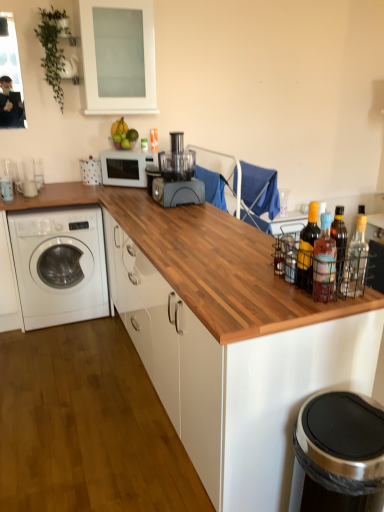
At what (x,y) coordinates should I click in order to perform the action: click on matte yellow glass bottle at right, which is the 3th bottle from right to left. Please return your answer as a coordinate pair (x, y). Image resolution: width=384 pixels, height=512 pixels. Looking at the image, I should click on (307, 249).

You are a GUI agent. You are given a task and a screenshot of the screen. Output one action in this format:
    pyautogui.click(x=<x>, y=<y>)
    Task: Click on the translucent glass bottles at right, the 2th bottle from the right
    
    Given the screenshot: What is the action you would take?
    pyautogui.click(x=324, y=263)

Identify the location of white glossy washing machine at left. (59, 265).

This screenshot has height=512, width=384. Find the location of `matte gray blender at center`. matte gray blender at center is located at coordinates (177, 176).

The image size is (384, 512). What do you see at coordinates (230, 339) in the screenshot?
I see `wooden at center` at bounding box center [230, 339].

In order to face wooden at center, should I rotate leftwards or rightwards?

Rotate left and turn 9.503 degrees.

The image size is (384, 512). Find the location of `clear glass bottle at right, the third bottle in the left-to-right sequence`. clear glass bottle at right, the third bottle in the left-to-right sequence is located at coordinates click(356, 259).

Identify the location of matte yellow glass bottle at right, which is the 3th bottle from right to left. The width and height of the screenshot is (384, 512). (307, 249).

From the matte gray blender at center, count 3rd bottle to the right and point to it. Please provide its 2D coordinates.

[(356, 259)]

Is clear glass bottle at right, placed as the 1th bottle when sorted from right to left, taller or shorter than matte gray blender at center?

Clearly, clear glass bottle at right, placed as the 1th bottle when sorted from right to left, is taller compared to matte gray blender at center.

From a real-world perspective, is clear glass bottle at right, acting as the 3th bottle starting from the front, under matte gray blender at center?

Yes, from a real-world perspective, clear glass bottle at right, acting as the 3th bottle starting from the front, is beneath matte gray blender at center.

Which point is more distant from viewer, (357, 289) or (189, 158)?

The point (189, 158) is farther from the camera.

Relative to clear glass bottle at right, which is counted as the first bottle, starting from the back, is matte gray blender at center in front or behind?

matte gray blender at center is in front of clear glass bottle at right, which is counted as the first bottle, starting from the back.

Which of these two, matte gray blender at center or clear glass bottle at right, acting as the 3th bottle starting from the front, is bigger?

Result: With larger size is clear glass bottle at right, acting as the 3th bottle starting from the front.

Which is behind, point (172, 173) or point (355, 238)?

The point (172, 173) is more distant.

Is matte gray blender at center positioned beyond the bounds of clear glass bottle at right, which is counted as the first bottle, starting from the back?

Yes, matte gray blender at center is outside of clear glass bottle at right, which is counted as the first bottle, starting from the back.

Considering the positions of objects white glossy washing machine at left and white matte microwave at center in the image provided, who is more to the left, white glossy washing machine at left or white matte microwave at center?

From the viewer's perspective, white glossy washing machine at left appears more on the left side.

The height and width of the screenshot is (512, 384). What are the coordinates of `home appliance that appears above the white glossy washing machine at left (from a real-world perspective)` in the screenshot? It's located at (126, 167).

In the scene shown: Is white glossy washing machine at left positioned beyond the bounds of white matte microwave at center?

Yes.

Is white matte microwave at center wider or thinner than matte gray blender at center?

In the image, white matte microwave at center appears to be more narrow than matte gray blender at center.

Is white matte microwave at center bigger than matte gray blender at center?

No, white matte microwave at center is not bigger than matte gray blender at center.

Can you tell me how much white matte microwave at center and matte gray blender at center differ in facing direction?

There is a 47.8-degree angle between the facing directions of white matte microwave at center and matte gray blender at center.

Can we say white matte microwave at center lies outside matte gray blender at center?

Yes, white matte microwave at center is outside of matte gray blender at center.

Which is closer, (38, 236) or (153, 198)?

Point (38, 236).

Considering the relative positions of white glossy washing machine at left and matte gray blender at center in the image provided, is white glossy washing machine at left to the left of matte gray blender at center from the viewer's perspective?

Yes.

Which of these two, white glossy washing machine at left or matte gray blender at center, is smaller?

With smaller size is matte gray blender at center.

Is white glossy washing machine at left beside matte gray blender at center?

white glossy washing machine at left and matte gray blender at center are clearly separated.

Would you say wooden at center is to the left or to the right of translucent glass bottles at right, which ranks as the 2th bottle in left-to-right order, in the picture?

Based on their positions, wooden at center is located to the left of translucent glass bottles at right, which ranks as the 2th bottle in left-to-right order.

Considering the positions of objects wooden at center and translucent glass bottles at right, which ranks as the 3th bottle in back-to-front order, in the image provided, who is behind, wooden at center or translucent glass bottles at right, which ranks as the 3th bottle in back-to-front order,?

translucent glass bottles at right, which ranks as the 3th bottle in back-to-front order, is further away from the camera.

Locate an element on the screen. This screenshot has width=384, height=512. the 1st bottle above the wooden at center (from the image's perspective) is located at coordinates (x=324, y=263).

From a real-world perspective, between white matte microwave at center and white glossy washing machine at left, who is vertically lower?

From a 3D spatial view, white glossy washing machine at left is below.

Are white matte microwave at center and white glossy washing machine at left far apart?

That's not correct — white matte microwave at center is a little close to white glossy washing machine at left.

Where is `washing machine that appears below the white matte microwave at center (from a real-world perspective)`? washing machine that appears below the white matte microwave at center (from a real-world perspective) is located at coordinates (59, 265).

From the image's perspective, is white matte microwave at center on top of white glossy washing machine at left?

Yes, from the image's perspective, white matte microwave at center is above white glossy washing machine at left.

Which bottle is the 3rd one when counting from the right side of the matte gray blender at center? Please provide its 2D coordinates.

[(356, 259)]

Find the location of a particular element. This screenshot has height=512, width=384. blender that appears in front of the clear glass bottle at right, acting as the 3th bottle starting from the front is located at coordinates [x=177, y=176].

Estimate the real-world distances between objects in this image. Which object is closer to matte gray blender at center, clear glass bottle at right, placed as the 1th bottle when sorted from right to left, or white matte microwave at center?

white matte microwave at center lies closer to matte gray blender at center than the other object.

Estimate the real-world distances between objects in this image. Which object is closer to white glossy washing machine at left, wooden at center or white matte microwave at center?

white matte microwave at center is closer to white glossy washing machine at left.

Considering their positions, is translucent glass bottles at right, which ranks as the 2th bottle in left-to-right order, positioned closer to white glossy washing machine at left than matte gray blender at center?

matte gray blender at center is positioned closer to the anchor white glossy washing machine at left.

Which object lies further to the anchor point matte gray blender at center, transparent glass cabinet at upper center or white matte microwave at center?

Based on the image, transparent glass cabinet at upper center appears to be further to matte gray blender at center.

From the image, which object appears to be nearer to matte gray blender at center, wooden at center or clear glass bottle at right, which is counted as the first bottle, starting from the back?

wooden at center lies closer to matte gray blender at center than the other object.

Looking at the image, which one is located closer to transparent glass cabinet at upper center, matte yellow glass bottle at right, which is the second bottle from back to front, or matte gray blender at center?

matte gray blender at center is closer to transparent glass cabinet at upper center.

Based on their spatial positions, is matte gray blender at center or clear glass bottle at right, placed as the 1th bottle when sorted from right to left, further from white matte microwave at center?

clear glass bottle at right, placed as the 1th bottle when sorted from right to left, is positioned further to the anchor white matte microwave at center.

When comparing their distances from white glossy washing machine at left, does translucent glass bottles at right, arranged as the first bottle when viewed from the front, or transparent glass cabinet at upper center seem further?

Based on the image, translucent glass bottles at right, arranged as the first bottle when viewed from the front, appears to be further to white glossy washing machine at left.

In order to click on home appliance between white glossy washing machine at left and clear glass bottle at right, acting as the 3th bottle starting from the front, in the horizontal direction in this screenshot , I will do `click(126, 167)`.

Identify the location of home appliance between transparent glass cabinet at upper center and clear glass bottle at right, acting as the 3th bottle starting from the front, from left to right. (126, 167).

Locate an element on the screen. washing machine between matte yellow glass bottle at right, which is the second bottle from back to front, and white matte microwave at center, along the z-axis is located at coordinates (59, 265).

Find the location of a particular element. The height and width of the screenshot is (512, 384). blender situated between white matte microwave at center and clear glass bottle at right, acting as the 3th bottle starting from the front, from left to right is located at coordinates (177, 176).